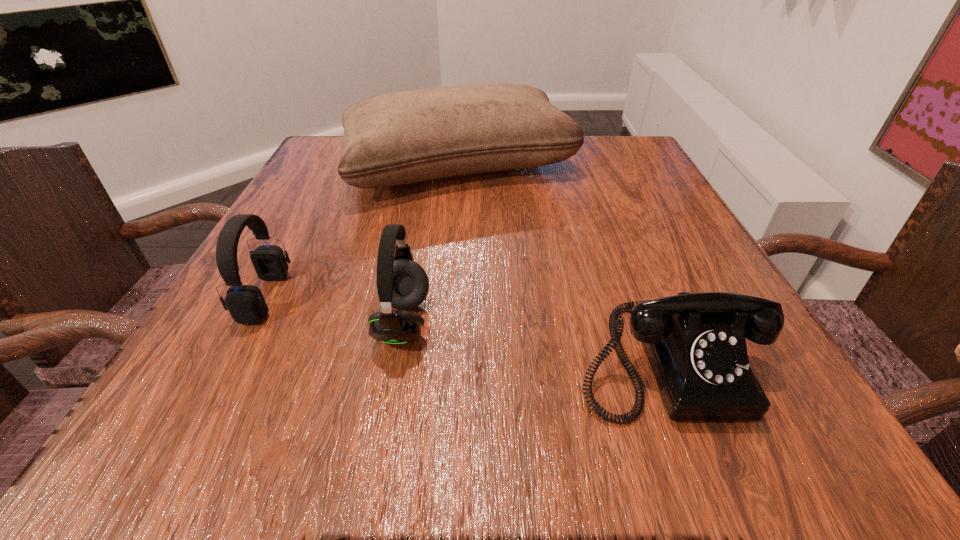
Locate an element on the screen. Image resolution: width=960 pixels, height=540 pixels. vacant area that lies between the telephone and the farthest object is located at coordinates point(562,263).

Identify the location of free space between the cushion and the telephone. Image resolution: width=960 pixels, height=540 pixels. (562, 263).

Identify the location of vacant space that's between the telephone and the farthest object. Image resolution: width=960 pixels, height=540 pixels. (562, 263).

You are a GUI agent. You are given a task and a screenshot of the screen. Output one action in this format:
    pyautogui.click(x=<x>, y=<y>)
    Task: Click on the free space between the left headset and the right headset
    
    Given the screenshot: What is the action you would take?
    pyautogui.click(x=334, y=309)

Where is `free point between the telephone and the cushion`? free point between the telephone and the cushion is located at coordinates (562, 263).

This screenshot has width=960, height=540. I want to click on free space between the left headset and the telephone, so click(x=465, y=327).

The height and width of the screenshot is (540, 960). What are the coordinates of `free point between the telephone and the cushion` in the screenshot? It's located at (562, 263).

Image resolution: width=960 pixels, height=540 pixels. Find the location of `vacant point located between the left headset and the right headset`. vacant point located between the left headset and the right headset is located at coordinates (334, 309).

Identify the location of vacant point located between the left headset and the right headset. The height and width of the screenshot is (540, 960). (334, 309).

Choose which object is the third nearest neighbor to the farthest object. Please provide its 2D coordinates. Your answer should be formatted as a tuple, i.e. [(x, y)], where the tuple contains the x and y coordinates of a point satisfying the conditions above.

[(696, 345)]